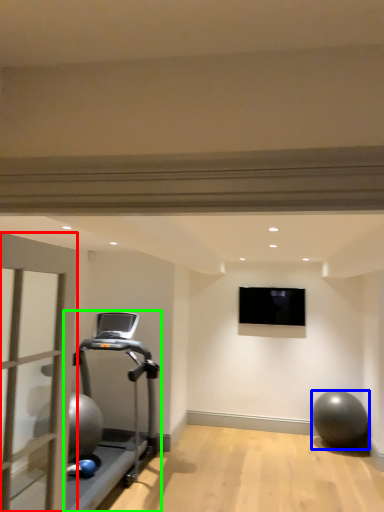
Question: Which object is the closest to the garage door (highlighted by a red box)? Choose among these: ball (highlighted by a blue box) or treadmill (highlighted by a green box).

Choices:
 (A) ball
 (B) treadmill

Answer: (B)